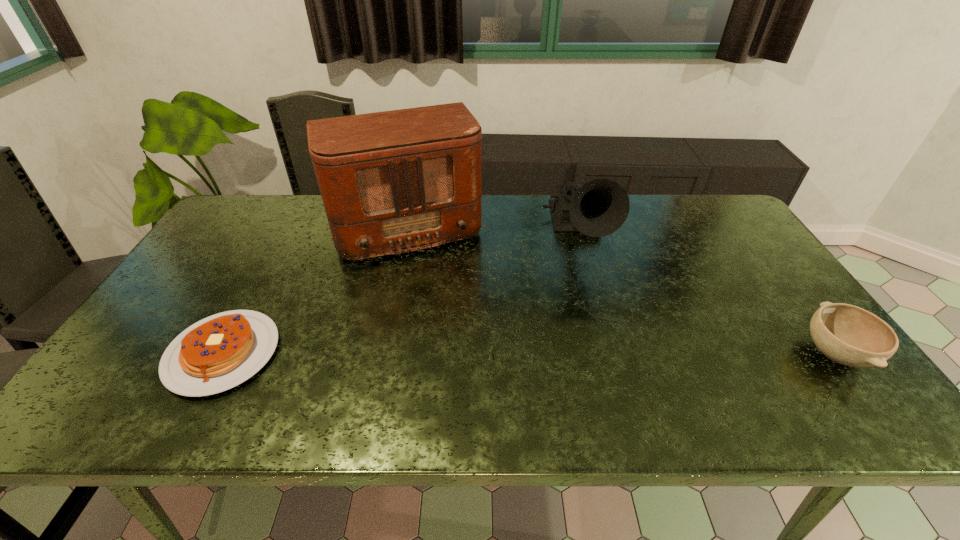
Identify the location of vacant area situated 0.310m from the horn of the second object from right to left. (612, 363).

Where is `vacant space located 0.080m on the front panel of the tallest object`? vacant space located 0.080m on the front panel of the tallest object is located at coordinates pyautogui.click(x=427, y=285).

Find the location of a particular element. vacant region located 0.250m on the front panel of the tallest object is located at coordinates (443, 329).

Where is `free location located on the front panel of the tallest object`? free location located on the front panel of the tallest object is located at coordinates (432, 300).

Locate an element on the screen. The width and height of the screenshot is (960, 540). phonograph_record located at the far edge is located at coordinates (599, 207).

Where is `radio receiver situated at the far edge`? Image resolution: width=960 pixels, height=540 pixels. radio receiver situated at the far edge is located at coordinates (391, 182).

The image size is (960, 540). Identify the location of pancake present at the near edge. (219, 352).

Where is `bowl present at the near edge`? bowl present at the near edge is located at coordinates (846, 334).

Locate an element on the screen. This screenshot has height=540, width=960. object present at the left edge is located at coordinates (219, 352).

Locate an element on the screen. This screenshot has height=540, width=960. object present at the right edge is located at coordinates (846, 334).